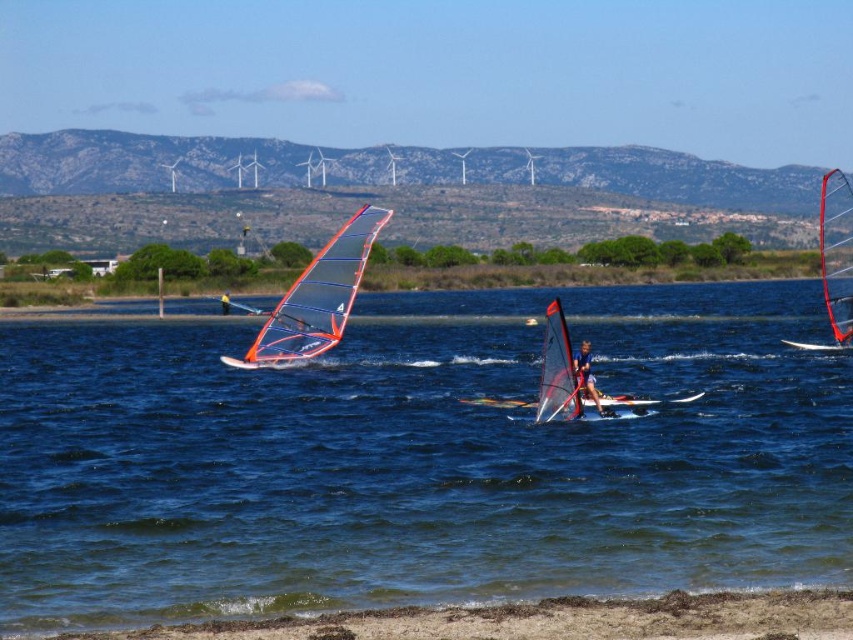
Can you confirm if blue water at center is thinner than orange glossy sail at center?

No.

Does blue water at center appear over orange glossy sail at center?

No.

Locate an element on the screen. The height and width of the screenshot is (640, 853). blue water at center is located at coordinates (418, 460).

Image resolution: width=853 pixels, height=640 pixels. What are the coordinates of `blue water at center` in the screenshot? It's located at (418, 460).

Who is more forward, (836, 314) or (582, 342)?

Positioned in front is point (582, 342).

Which of these two, red matte sail at right or blue matte windsurfing sail at center, stands shorter?

blue matte windsurfing sail at center is shorter.

Does point (840, 296) lie behind point (589, 380)?

Yes, it is behind point (589, 380).

This screenshot has width=853, height=640. What are the coordinates of `red matte sail at right` in the screenshot? It's located at (834, 259).

Can you confirm if blue matte windsurfing sail at center is positioned to the left of matte orange windsurfing board at center?

In fact, blue matte windsurfing sail at center is to the right of matte orange windsurfing board at center.

Which is more to the left, blue matte windsurfing sail at center or matte orange windsurfing board at center?

matte orange windsurfing board at center

The height and width of the screenshot is (640, 853). What are the coordinates of `blue matte windsurfing sail at center` in the screenshot? It's located at (585, 372).